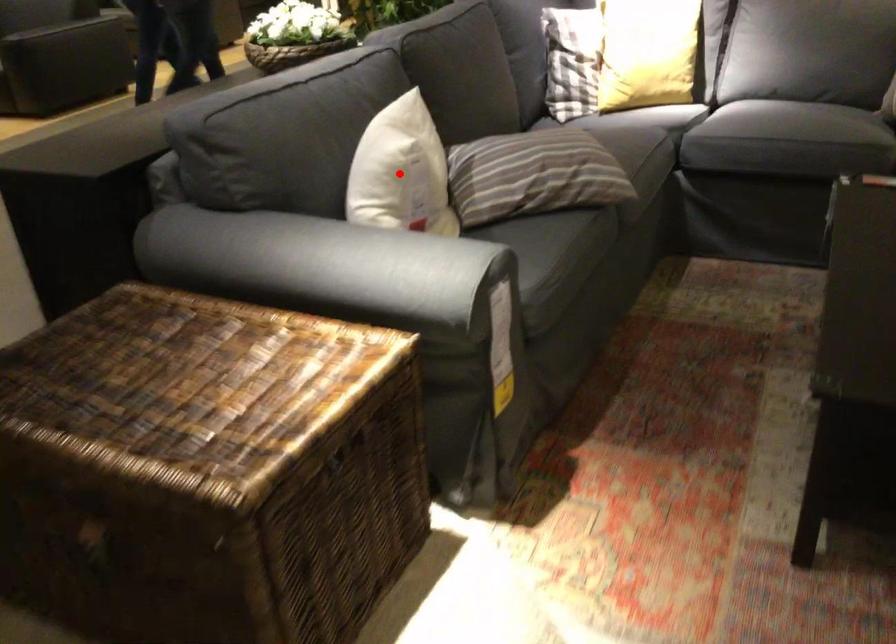
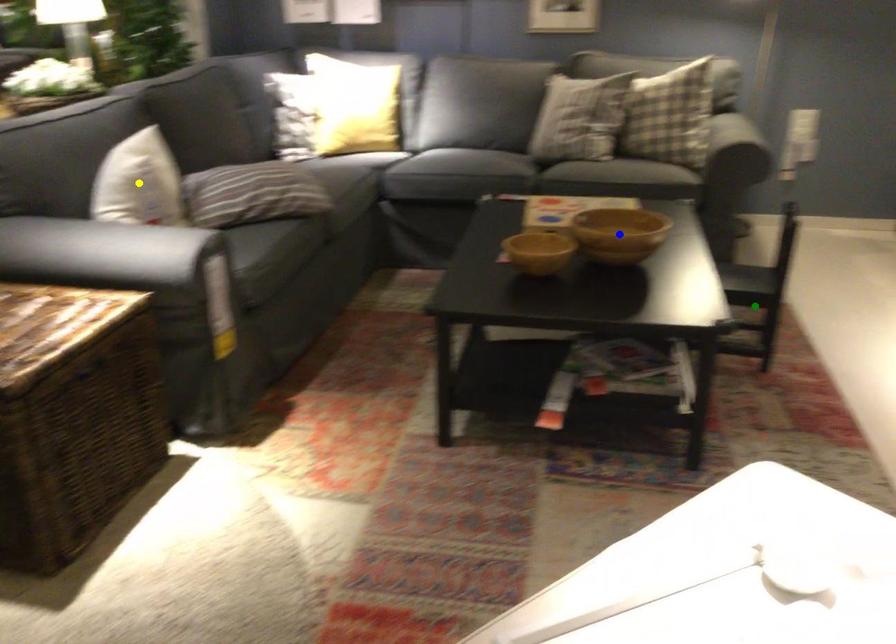
Question: I am providing you with two images of the same scene from different viewpoints. A red point is marked on the first image. You are given multiple points on the second image. Which point in image 2 is actually the same real-world point as the red point in image 1?

Choices:
 (A) green point
 (B) yellow point
 (C) blue point

Answer: (B)